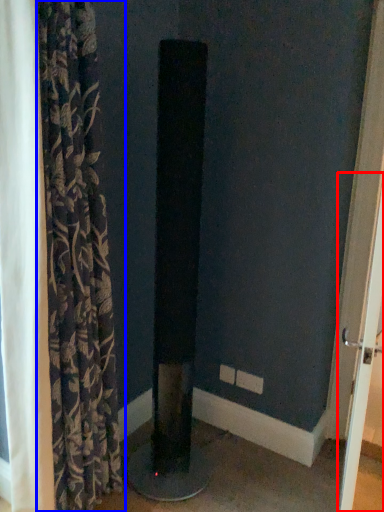
Question: Which point is closer to the camera, screen door (highlighted by a red box) or curtain (highlighted by a blue box)?

Choices:
 (A) screen door
 (B) curtain

Answer: (B)